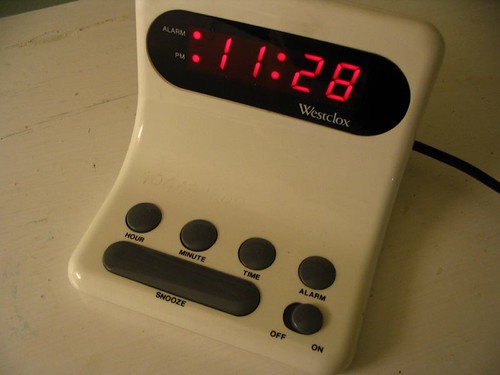
The height and width of the screenshot is (375, 500). What are the coordinates of `black cable` in the screenshot? It's located at (451, 160).